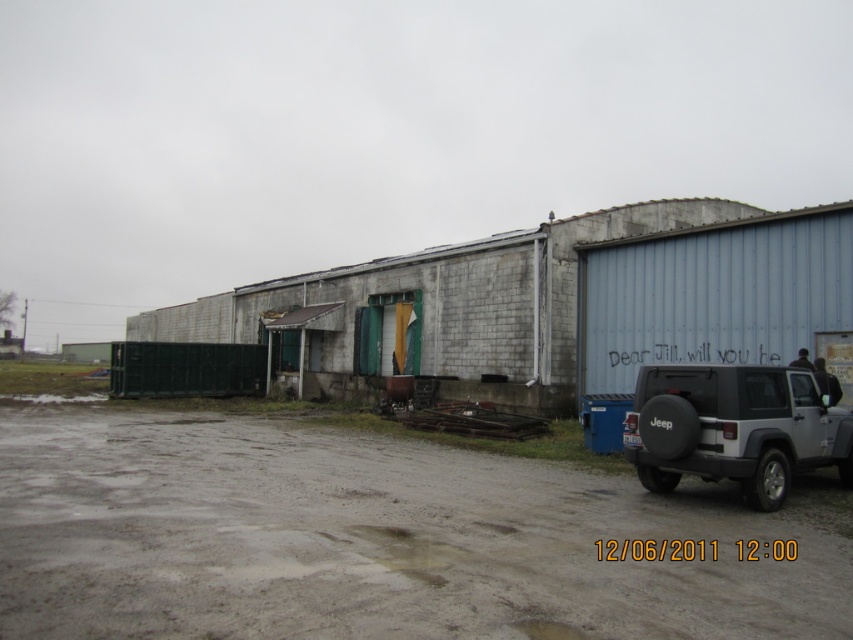
Question: Which of the following is the closest to the observer?

Choices:
 (A) (96, 412)
 (B) (759, 438)

Answer: (B)

Question: Which point appears farthest from the camera in this image?

Choices:
 (A) (733, 403)
 (B) (527, 570)

Answer: (A)

Question: Does gray dirt track at lower center appear under silver matte jeep at right?

Choices:
 (A) yes
 (B) no

Answer: (A)

Question: Does gray dirt track at lower center have a larger size compared to silver matte jeep at right?

Choices:
 (A) no
 (B) yes

Answer: (B)

Question: Is gray dirt track at lower center bigger than silver matte jeep at right?

Choices:
 (A) yes
 (B) no

Answer: (A)